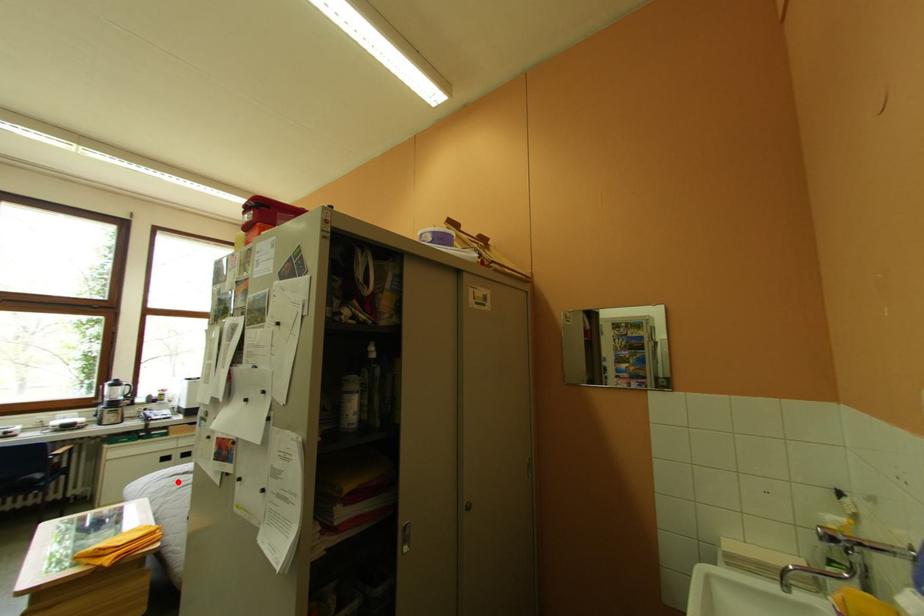
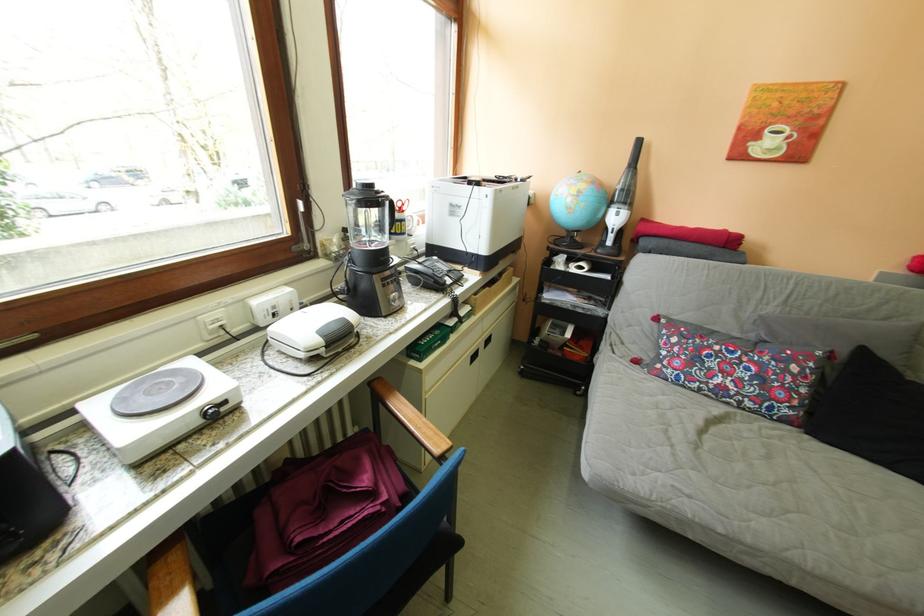
Where in the second image is the point corresponding to the highlighted location from the first image?

(713, 455)